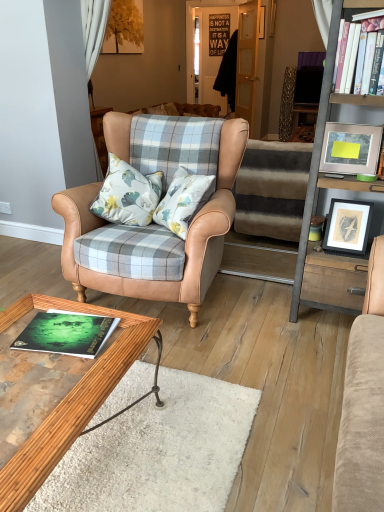
At what (x,y) coordinates should I click in order to perform the action: click on empty space that is ontop of wooden polished coffee table at lower left (from a real-world perspective). Please return your answer as a coordinate pair (x, y). This screenshot has width=384, height=512. Looking at the image, I should click on [x=51, y=353].